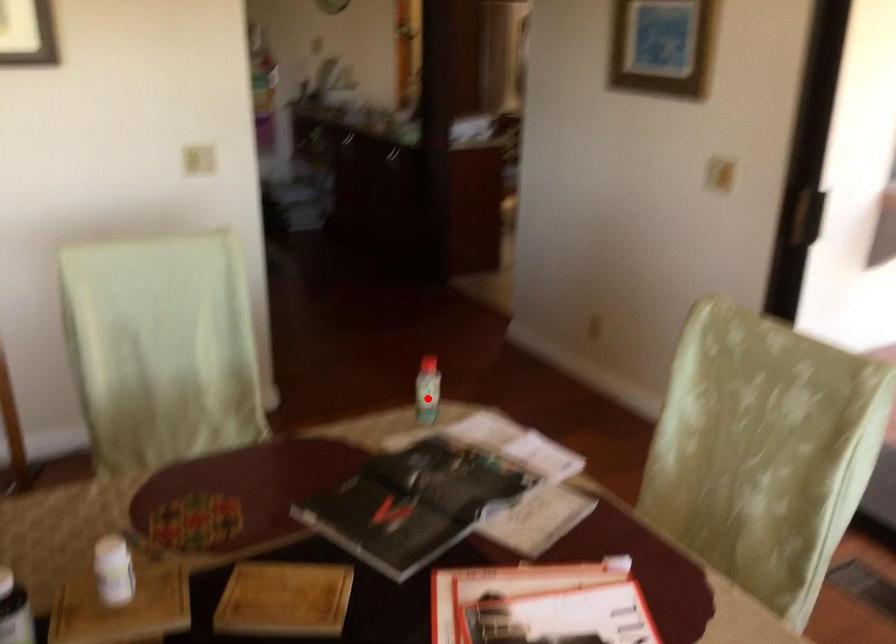
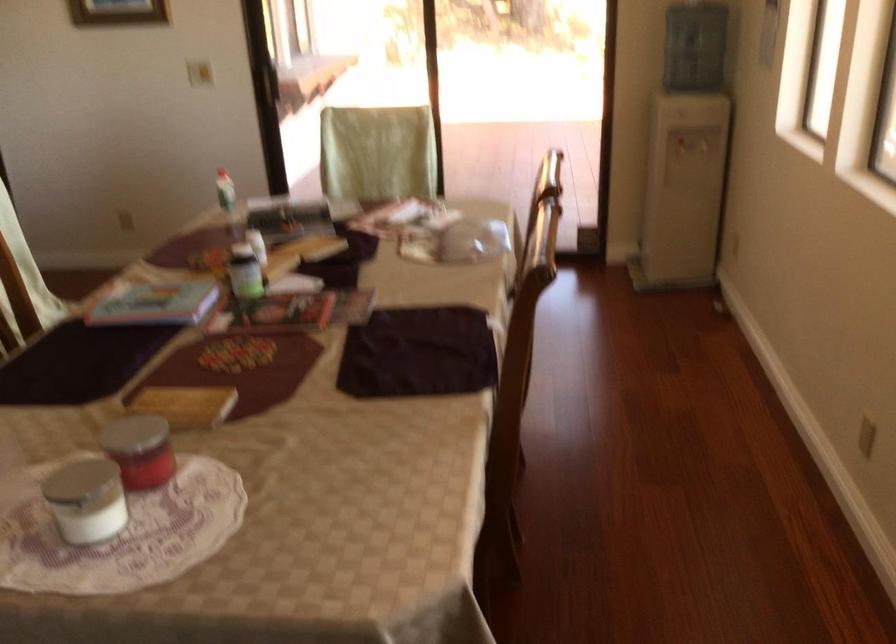
The point at the highlighted location is marked in the first image. Where is the corresponding point in the second image?

(225, 190)